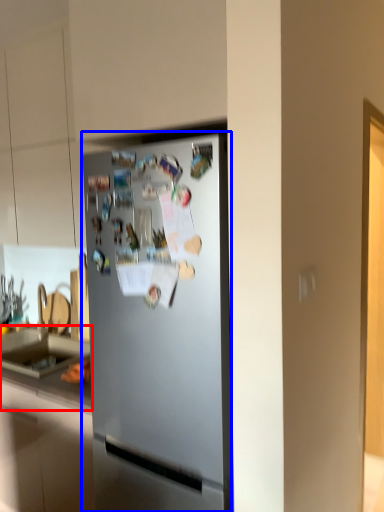
Question: Which object appears closest to the camera in this image, counter top (highlighted by a red box) or refrigerator (highlighted by a blue box)?

Choices:
 (A) counter top
 (B) refrigerator

Answer: (B)